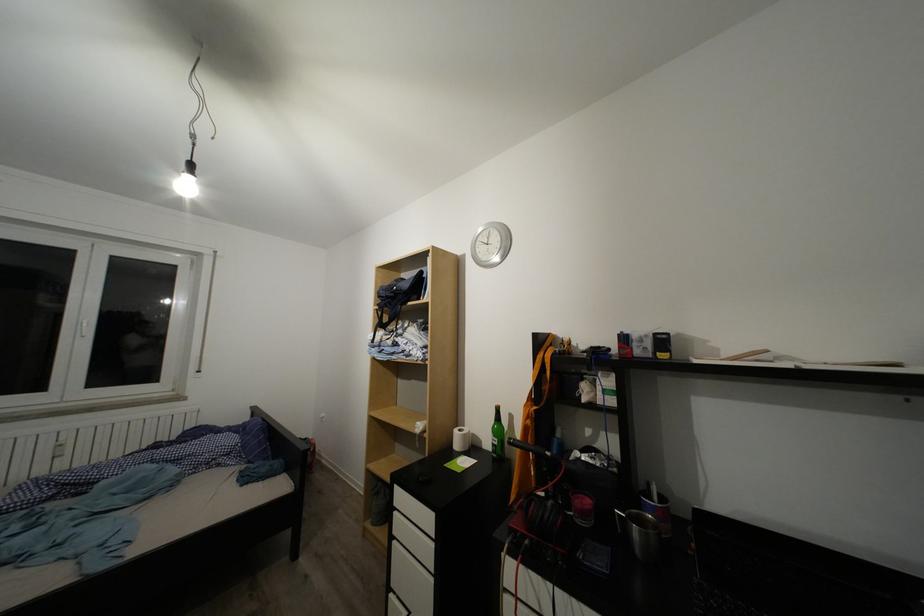
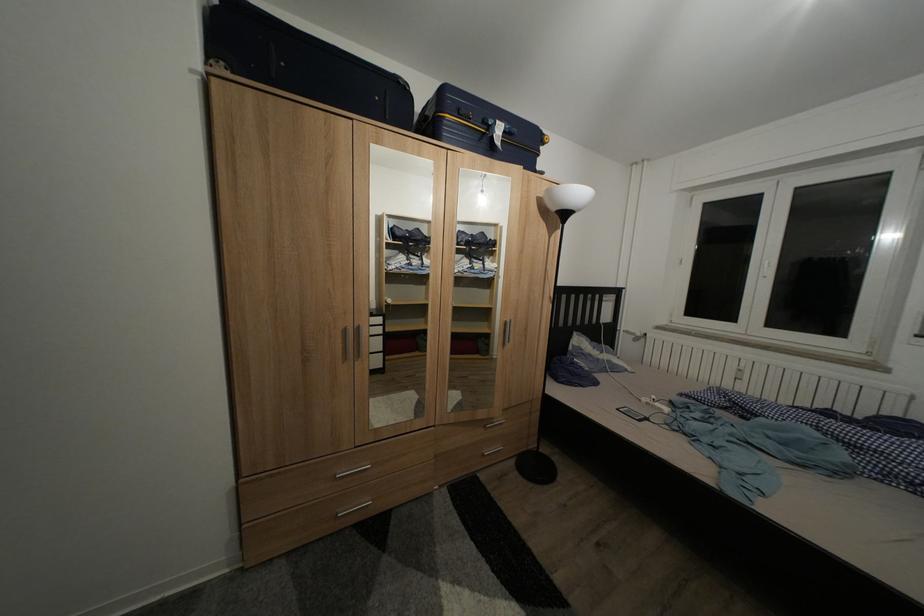
Question: The camera is either moving clockwise (left) or counter-clockwise (right) around the object. The first image is from the beginning of the video and the second image is from the end. Is the camera moving left or right when shooting the video?

Choices:
 (A) Left
 (B) Right

Answer: (B)